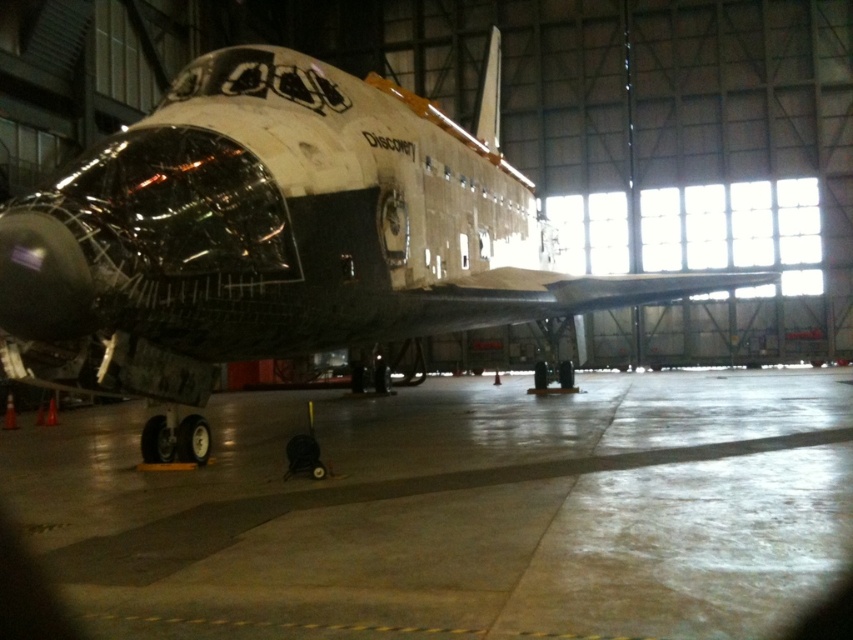
Question: Is concrete at center wider than white matte space shuttle at center?

Choices:
 (A) no
 (B) yes

Answer: (A)

Question: Which object is farther from the camera taking this photo?

Choices:
 (A) concrete at center
 (B) white matte space shuttle at center

Answer: (B)

Question: Is concrete at center in front of white matte space shuttle at center?

Choices:
 (A) yes
 (B) no

Answer: (A)

Question: Which point appears closest to the camera in this image?

Choices:
 (A) (421, 564)
 (B) (248, 109)

Answer: (A)

Question: Considering the relative positions of concrete at center and white matte space shuttle at center in the image provided, where is concrete at center located with respect to white matte space shuttle at center?

Choices:
 (A) above
 (B) below

Answer: (B)